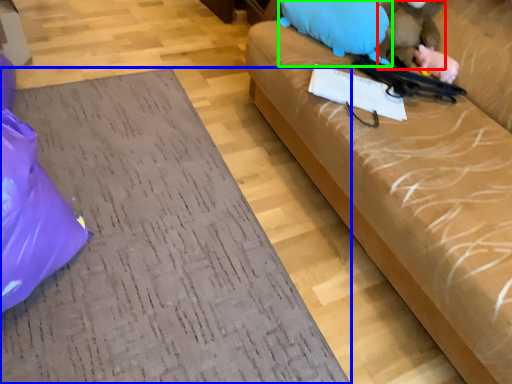
Question: Estimate the real-world distances between objects in this image. Which object is farther from animal (highlighted by a red box), furniture (highlighted by a blue box) or animal (highlighted by a green box)?

Choices:
 (A) furniture
 (B) animal

Answer: (A)